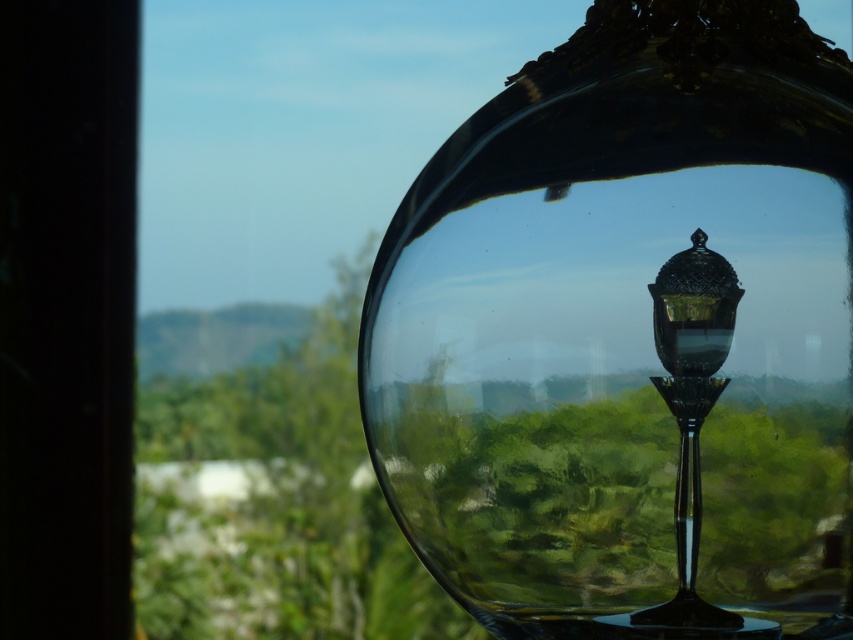
You are a designer trying to arrange these two items in a way that maintains their current spatial relationship. If you were to move the transparent glass bowl at center to the left side of the room, where should you place the black glass lamp post at center to keep their original positions relative to each other?

To maintain their original spatial relationship, the black glass lamp post at center should be placed below the transparent glass bowl at center when it is moved to the left side of the room, as the transparent glass bowl at center was originally above the black glass lamp post at center.

You are an interior designer assessing a glass sphere that reflects the environment. You notice the green leafy tree at center and the black glass lamp post at center in the reflection. Which object appears bigger in the reflection?

The green leafy tree at center appears bigger in the reflection because it has a larger size compared to the black glass lamp post at center.

You are standing in front of the transparent glass bowl at center and the green leafy tree at center. Which object is closer to you?

The transparent glass bowl at center is closer to you because it is in front of the green leafy tree at center.